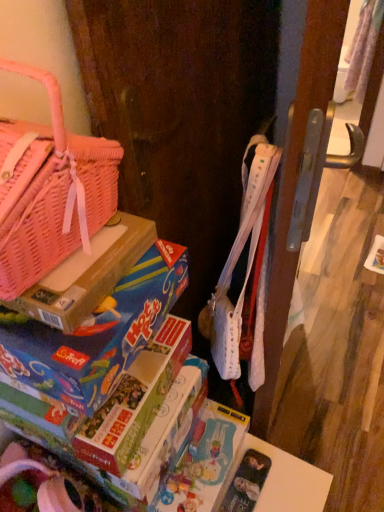
Question: From a real-world perspective, is matte cardboard book at lower left over pink woven basket at upper left?

Choices:
 (A) no
 (B) yes

Answer: (A)

Question: Is matte cardboard book at lower left next to pink woven basket at upper left?

Choices:
 (A) yes
 (B) no

Answer: (B)

Question: From the image's perspective, is matte cardboard book at lower left located above pink woven basket at upper left?

Choices:
 (A) no
 (B) yes

Answer: (A)

Question: Can you confirm if matte cardboard book at lower left is thinner than pink woven basket at upper left?

Choices:
 (A) yes
 (B) no

Answer: (B)

Question: Does matte cardboard book at lower left turn towards pink woven basket at upper left?

Choices:
 (A) yes
 (B) no

Answer: (B)

Question: From the image's perspective, is matte cardboard book at lower left located beneath pink woven basket at upper left?

Choices:
 (A) yes
 (B) no

Answer: (A)

Question: Is cardboard box at left smaller than matte cardboard book at lower left?

Choices:
 (A) no
 (B) yes

Answer: (B)

Question: Is cardboard box at left further to the viewer compared to matte cardboard book at lower left?

Choices:
 (A) yes
 (B) no

Answer: (B)

Question: Can you confirm if cardboard box at left is shorter than matte cardboard book at lower left?

Choices:
 (A) no
 (B) yes

Answer: (B)

Question: Is cardboard box at left at the left side of matte cardboard book at lower left?

Choices:
 (A) yes
 (B) no

Answer: (A)

Question: Is cardboard box at left oriented towards matte cardboard book at lower left?

Choices:
 (A) no
 (B) yes

Answer: (A)

Question: Does cardboard box at left have a lesser width compared to matte cardboard book at lower left?

Choices:
 (A) no
 (B) yes

Answer: (B)

Question: From the image's perspective, is pink woven basket at upper left on matte cardboard book at lower left?

Choices:
 (A) no
 (B) yes

Answer: (B)